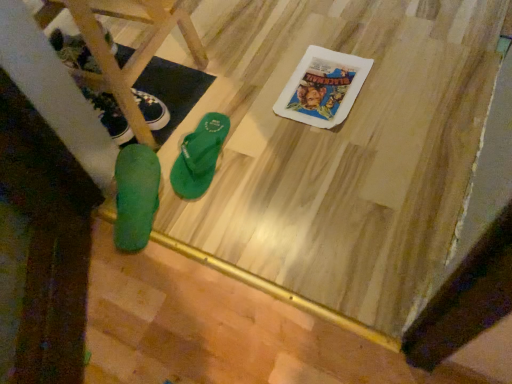
This screenshot has width=512, height=384. I want to click on free space to the back side of matte black sneaker at left, the 1th footwear when ordered from left to right, so click(x=151, y=66).